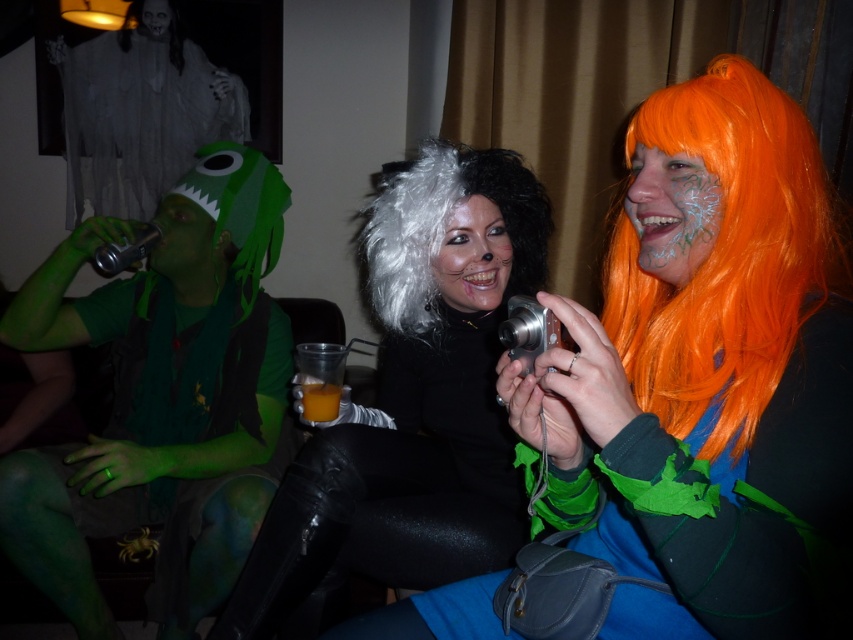
Question: Does white fabric ghost at upper left have a smaller size compared to orange wig at right?

Choices:
 (A) yes
 (B) no

Answer: (B)

Question: Based on their relative distances, which object is nearer to the white fabric ghost at upper left?

Choices:
 (A) translucent plastic cup at center
 (B) smooth white face at upper center
 (C) green matte beverage can at left
 (D) orange synthetic wig at right

Answer: (B)

Question: Which object is positioned farthest from the white fluffy wig at center?

Choices:
 (A) orange wig at right
 (B) green matte beverage can at left
 (C) orange synthetic wig at right

Answer: (A)

Question: Is green matte beverage can at left wider than white matte wig at center?

Choices:
 (A) yes
 (B) no

Answer: (A)

Question: Among these objects, which one is nearest to the camera?

Choices:
 (A) green matte skin at left
 (B) white fabric ghost at upper left

Answer: (A)

Question: Can you confirm if white fabric ghost at upper left is smaller than white matte wig at center?

Choices:
 (A) yes
 (B) no

Answer: (B)